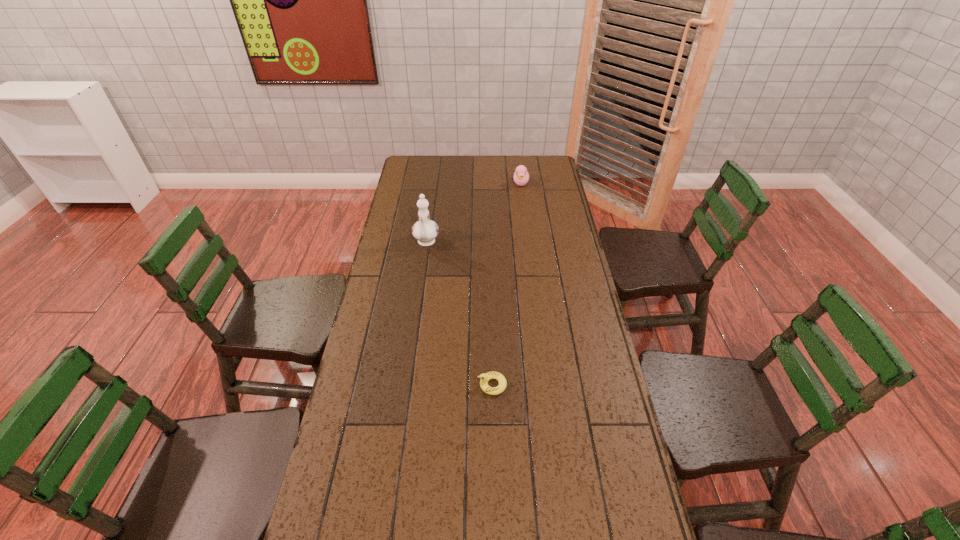
Choose which object is the second nearest neighbor to the second object from left to right. Please provide its 2D coordinates. Your answer should be formatted as a tuple, i.e. [(x, y)], where the tuple contains the x and y coordinates of a point satisfying the conditions above.

[(521, 176)]

Identify the location of free location that satisfies the following two spatial constraints: 1. on the front-facing side of the right duckling; 2. on the face of the left duckling. This screenshot has width=960, height=540. (547, 385).

Where is `free point that satisfies the following two spatial constraints: 1. on the front-facing side of the farther duckling; 2. on the face of the second object from right to left`? The width and height of the screenshot is (960, 540). free point that satisfies the following two spatial constraints: 1. on the front-facing side of the farther duckling; 2. on the face of the second object from right to left is located at coordinates (547, 385).

This screenshot has height=540, width=960. I want to click on free spot that satisfies the following two spatial constraints: 1. on the front-facing side of the second tallest object; 2. on the face of the left duckling, so click(547, 385).

The height and width of the screenshot is (540, 960). Identify the location of blank area in the image that satisfies the following two spatial constraints: 1. on the front-facing side of the farther duckling; 2. on the face of the shorter duckling. (547, 385).